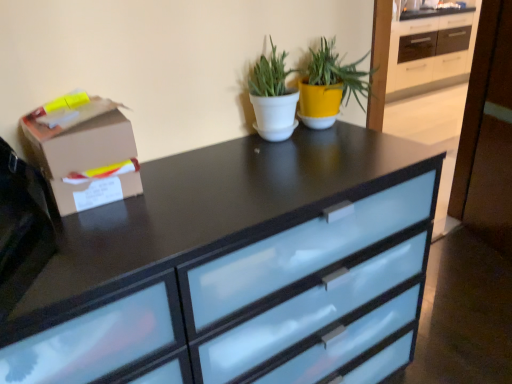
Question: Does satin black chest of drawers at center contain white matte pot at center, which is counted as the first houseplant, starting from the left?

Choices:
 (A) no
 (B) yes

Answer: (A)

Question: Could you tell me if satin black chest of drawers at center is facing white matte pot at center, the second houseplant viewed from the right?

Choices:
 (A) no
 (B) yes

Answer: (A)

Question: Considering the relative sizes of satin black chest of drawers at center and white matte pot at center, which is counted as the first houseplant, starting from the left, in the image provided, is satin black chest of drawers at center taller than white matte pot at center, which is counted as the first houseplant, starting from the left,?

Choices:
 (A) yes
 (B) no

Answer: (A)

Question: Are satin black chest of drawers at center and white matte pot at center, which is counted as the first houseplant, starting from the left, making contact?

Choices:
 (A) yes
 (B) no

Answer: (B)

Question: Can we say satin black chest of drawers at center lies outside white matte pot at center, the second houseplant viewed from the right?

Choices:
 (A) no
 (B) yes

Answer: (B)

Question: Considering the positions of point (247, 84) and point (329, 49), is point (247, 84) closer or farther from the camera than point (329, 49)?

Choices:
 (A) closer
 (B) farther

Answer: (A)

Question: Is white matte pot at center, which is counted as the first houseplant, starting from the left, taller or shorter than yellow matte pot at upper center, the 2th houseplant positioned from the left?

Choices:
 (A) short
 (B) tall

Answer: (B)

Question: Considering the positions of white matte pot at center, which is counted as the first houseplant, starting from the left, and yellow matte pot at upper center, the 2th houseplant positioned from the left, in the image, is white matte pot at center, which is counted as the first houseplant, starting from the left, wider or thinner than yellow matte pot at upper center, the 2th houseplant positioned from the left,?

Choices:
 (A) wide
 (B) thin

Answer: (B)

Question: Based on their positions, is white matte pot at center, the second houseplant viewed from the right, located to the left or right of yellow matte pot at upper center, the first houseplant in the right-to-left sequence?

Choices:
 (A) left
 (B) right

Answer: (A)

Question: Is yellow matte pot at upper center, the 2th houseplant positioned from the left, inside the boundaries of white matte pot at center, which is counted as the first houseplant, starting from the left, or outside?

Choices:
 (A) outside
 (B) inside

Answer: (A)

Question: In the image, is yellow matte pot at upper center, the 2th houseplant positioned from the left, positioned in front of or behind white matte pot at center, the second houseplant viewed from the right?

Choices:
 (A) behind
 (B) front

Answer: (A)

Question: Is yellow matte pot at upper center, the 2th houseplant positioned from the left, taller or shorter than white matte pot at center, which is counted as the first houseplant, starting from the left?

Choices:
 (A) short
 (B) tall

Answer: (A)

Question: Is yellow matte pot at upper center, the first houseplant in the right-to-left sequence, wider or thinner than white matte pot at center, which is counted as the first houseplant, starting from the left?

Choices:
 (A) wide
 (B) thin

Answer: (A)

Question: In terms of width, does satin black chest of drawers at center look wider or thinner when compared to white matte pot at center, the second houseplant viewed from the right?

Choices:
 (A) thin
 (B) wide

Answer: (B)

Question: Considering their positions, is satin black chest of drawers at center located in front of or behind white matte pot at center, which is counted as the first houseplant, starting from the left?

Choices:
 (A) behind
 (B) front

Answer: (B)